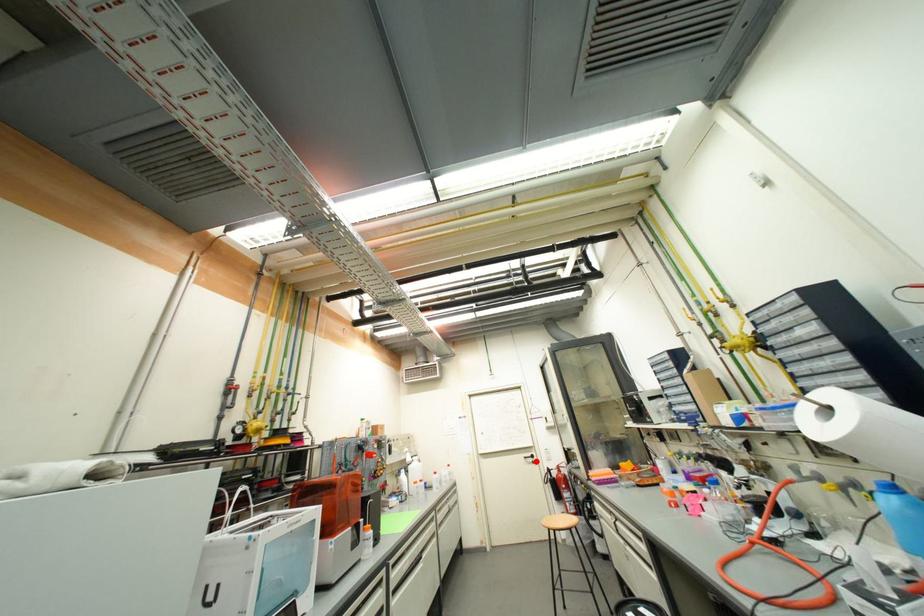
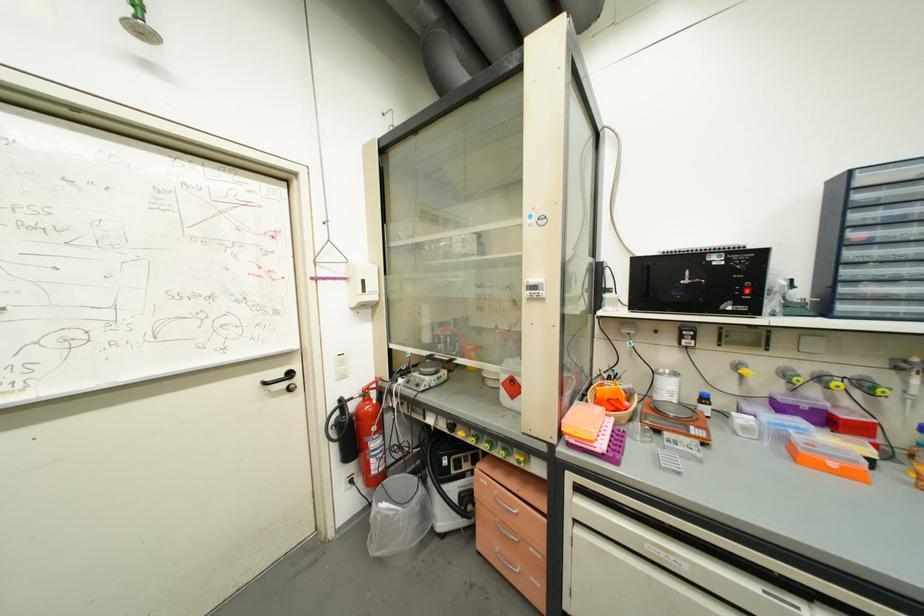
In the second image, find the point that corresponds to the highlighted location in the first image.

(289, 387)